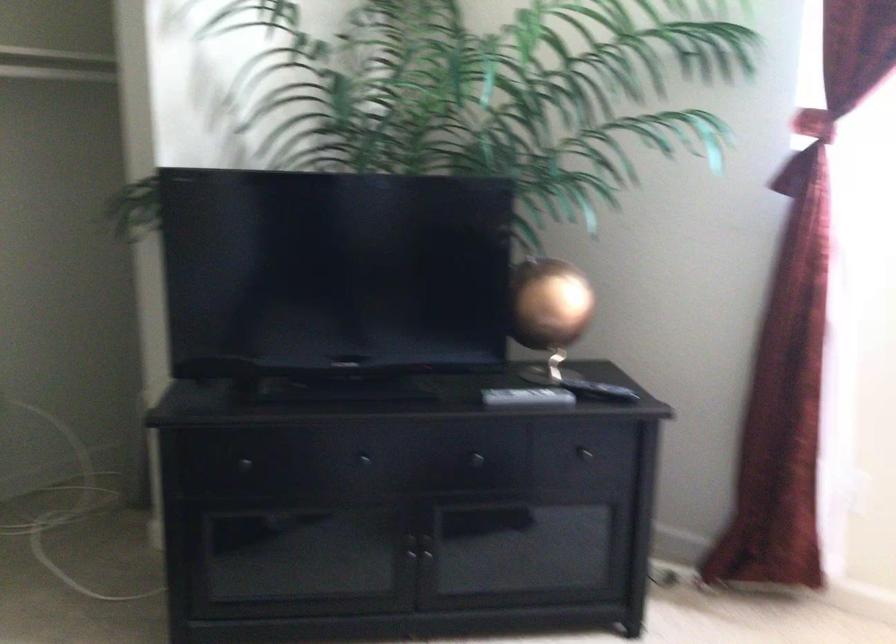
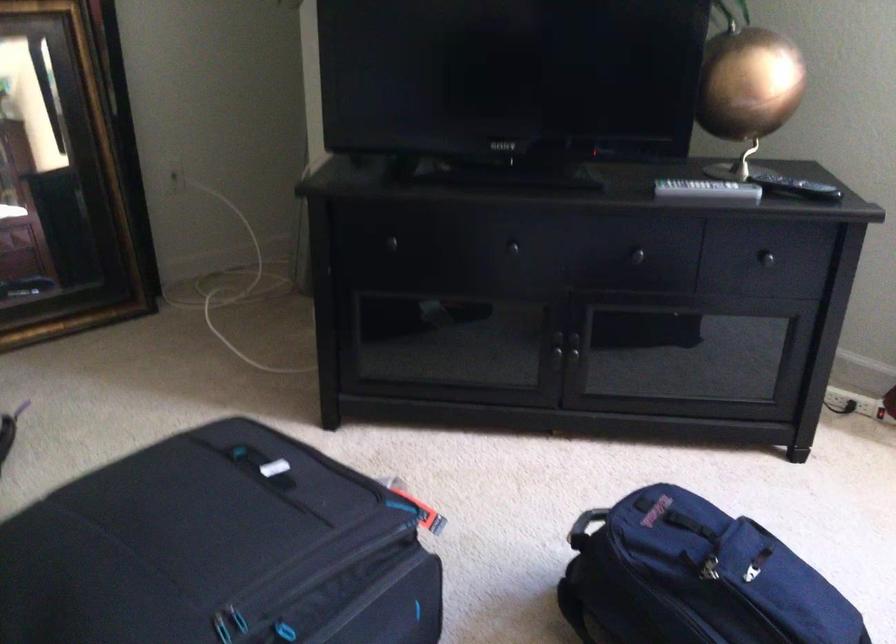
The point at (582, 456) is marked in the first image. Where is the corresponding point in the second image?

(760, 260)